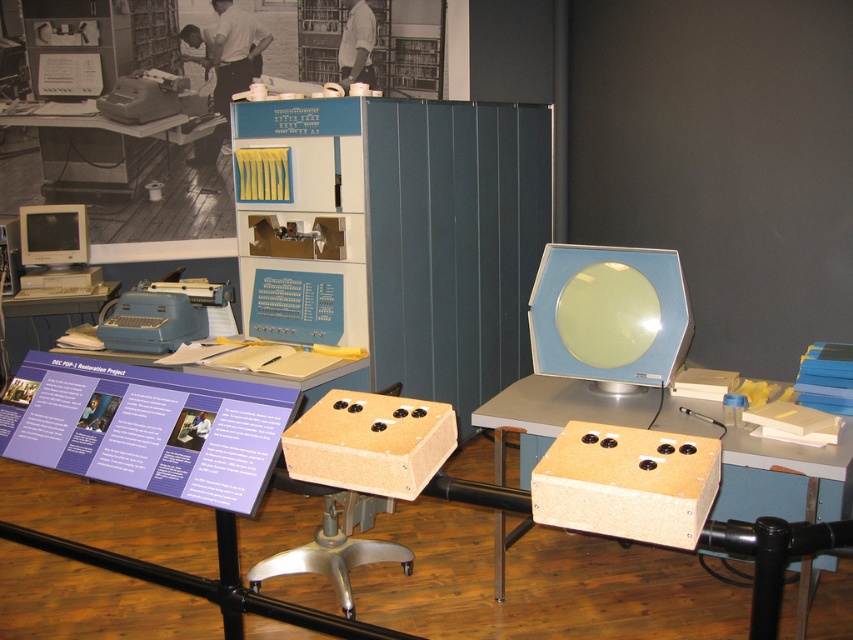
Looking at this image, does wooden at center lie behind matte white monitor at left?

No.

Describe the element at coordinates (784, 477) in the screenshot. I see `wooden at center` at that location.

Identify the location of wooden at center. The height and width of the screenshot is (640, 853). (784, 477).

Is point (566, 438) behind point (54, 305)?

No, (566, 438) is closer to viewer.

Where is `wooden box at center`? wooden box at center is located at coordinates (627, 483).

Find the location of a particular element. wooden box at center is located at coordinates (627, 483).

Can you confirm if wooden at center is taller than wooden desk at center?

Yes, wooden at center is taller than wooden desk at center.

Can you confirm if wooden at center is wider than wooden desk at center?

Yes.

Find the location of a particular element. This screenshot has width=853, height=640. wooden at center is located at coordinates [x=784, y=477].

Where is `wooden at center`? wooden at center is located at coordinates (784, 477).